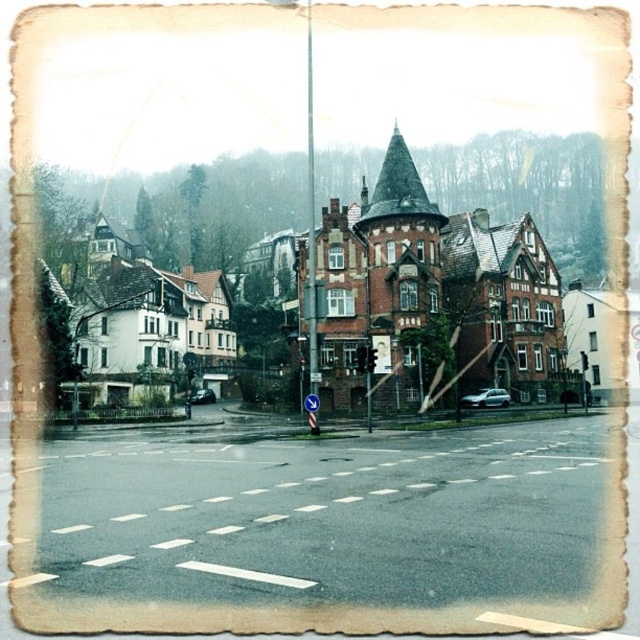
Which of these two, red brick building at center or white asphalt at center, stands taller?

With more height is red brick building at center.

Who is more distant from viewer, (113,278) or (196,502)?

The point (113,278) is more distant.

Which is behind, point (394, 161) or point (177, 474)?

The point (394, 161) is behind.

This screenshot has height=640, width=640. I want to click on red brick building at center, so click(x=452, y=266).